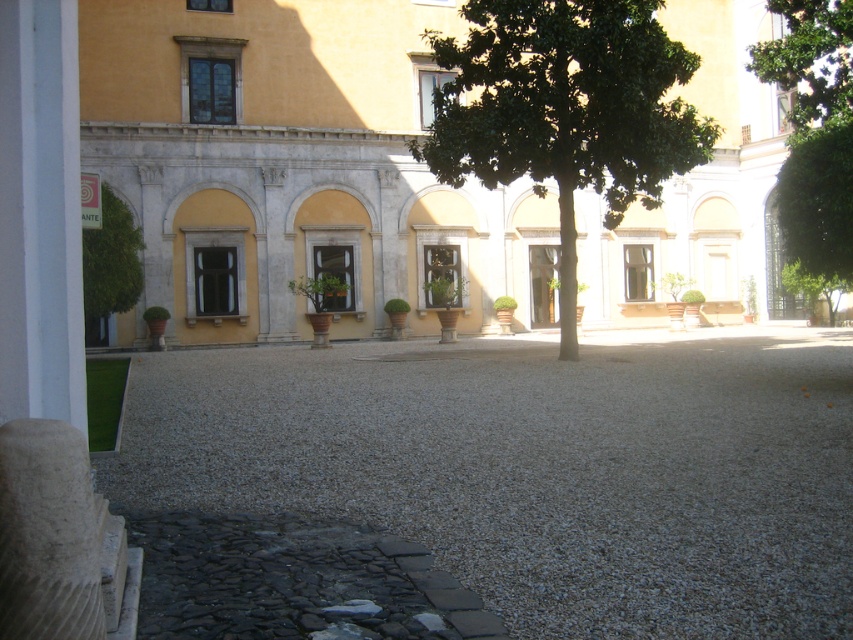
Question: Estimate the real-world distances between objects in this image. Which object is farther from the green leafy tree at center?

Choices:
 (A) green leafy tree at left
 (B) gray gravel at center

Answer: (A)

Question: Which of the following is the farthest from the observer?

Choices:
 (A) (816, 28)
 (B) (708, 132)
 (C) (631, 225)

Answer: (C)

Question: Does yellow stone building at center appear on the left side of green leafy tree at upper right?

Choices:
 (A) yes
 (B) no

Answer: (A)

Question: Is gray gravel at center to the right of yellow stone building at center from the viewer's perspective?

Choices:
 (A) yes
 (B) no

Answer: (B)

Question: Does gray gravel at center have a smaller size compared to green leafy tree at upper right?

Choices:
 (A) no
 (B) yes

Answer: (B)

Question: Which object is positioned farthest from the gray gravel at center?

Choices:
 (A) green leafy tree at center
 (B) green leafy tree at upper right
 (C) yellow stone building at center

Answer: (C)